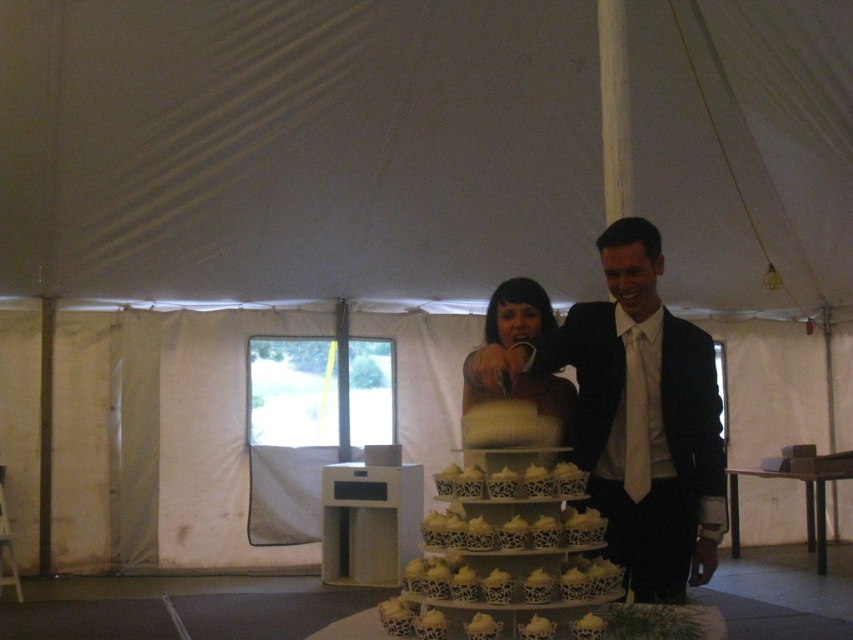
You are a photographer at the wedding and need to position yourself so that both the matte black suit at center and the matte white cake at center are fully visible in your shot. Given that your camera has a fixed focal length, which object should you ensure is closer to the camera to avoid cropping?

The matte black suit at center is wider than the matte white cake at center. To ensure both are fully visible without cropping, position the wider matte black suit at center closer to the camera. This will make it appear larger in the frame, allowing the narrower cake to fit within the same shot.

From the picture: You are a guest at the wedding and want to take a photo of both the white lace cupcake tower at center and the matte white cake at center. Which one should you focus on first if you want to capture both in your shot?

The white lace cupcake tower at center is below the matte white cake at center, so you should focus on the matte white cake at center first to ensure both are in frame.